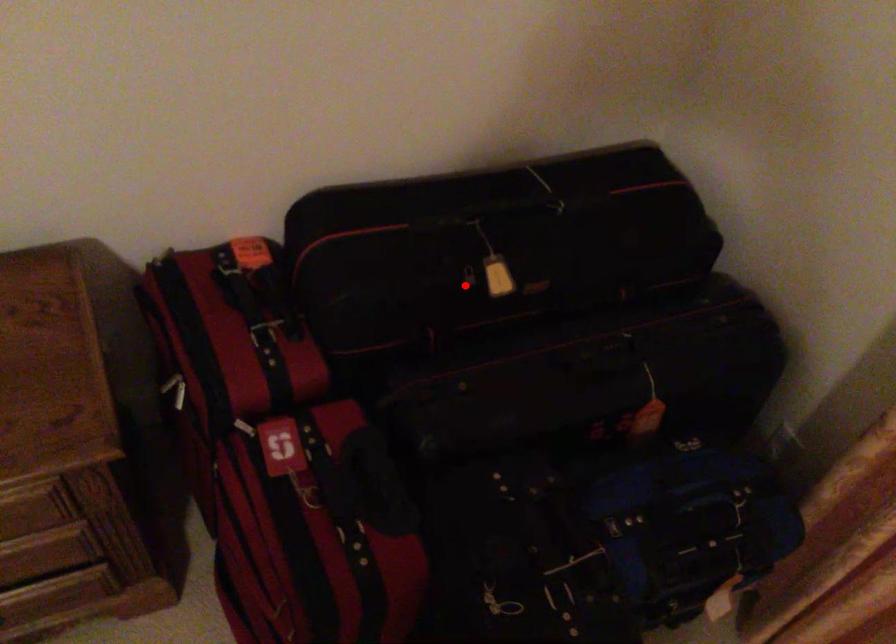
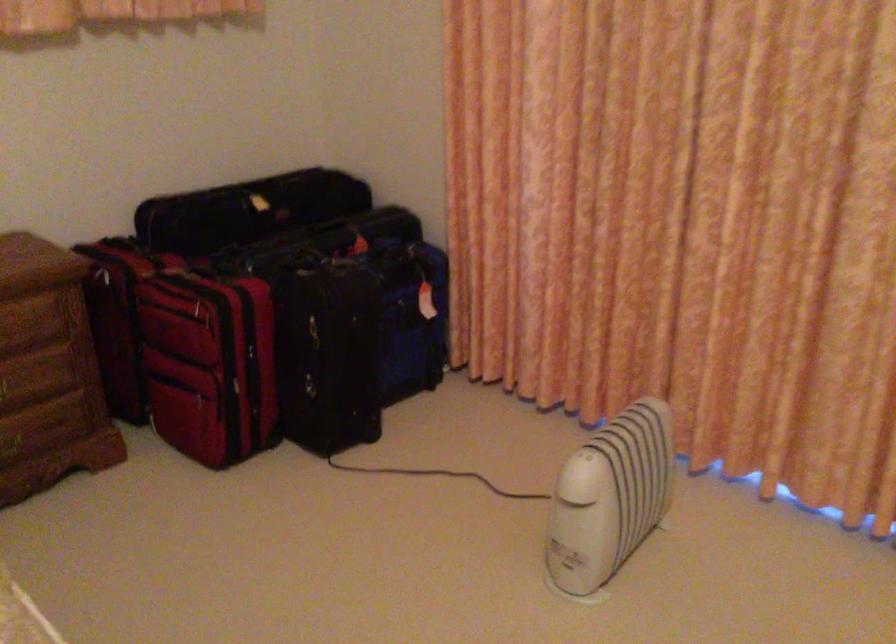
In the second image, find the point that corresponds to the highlighted location in the first image.

(247, 210)